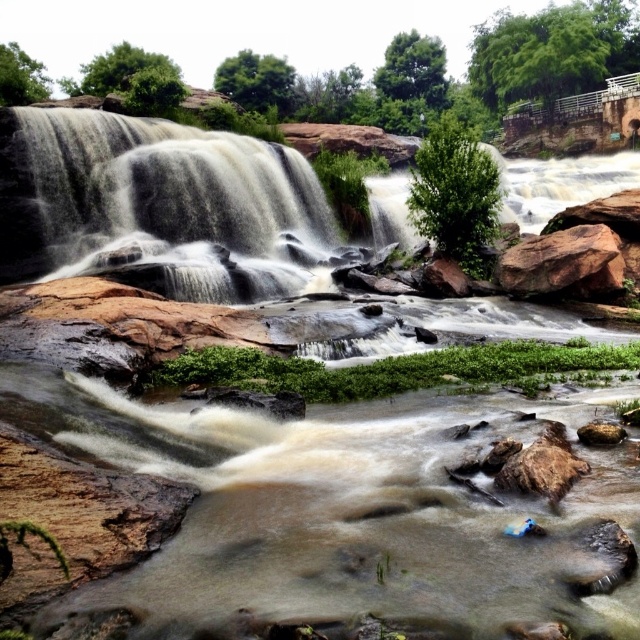
Question: Is grayish-white water at upper left below brown rough rock at lower right?

Choices:
 (A) no
 (B) yes

Answer: (A)

Question: Which object appears farthest from the camera in this image?

Choices:
 (A) brown rough rock at right
 (B) grayish-white water at upper left

Answer: (B)

Question: Which is farther from the brown rough rock at right?

Choices:
 (A) grayish-white water at upper left
 (B) brown rough rock at lower right

Answer: (B)

Question: Which point is closer to the camera?

Choices:
 (A) brown rough rock at right
 (B) grayish-white water at upper left
 (C) brown rough rock at lower right

Answer: (C)

Question: Can you confirm if grayish-white water at upper left is smaller than brown rough rock at right?

Choices:
 (A) yes
 (B) no

Answer: (A)

Question: Is grayish-white water at upper left wider than brown rough rock at right?

Choices:
 (A) no
 (B) yes

Answer: (A)